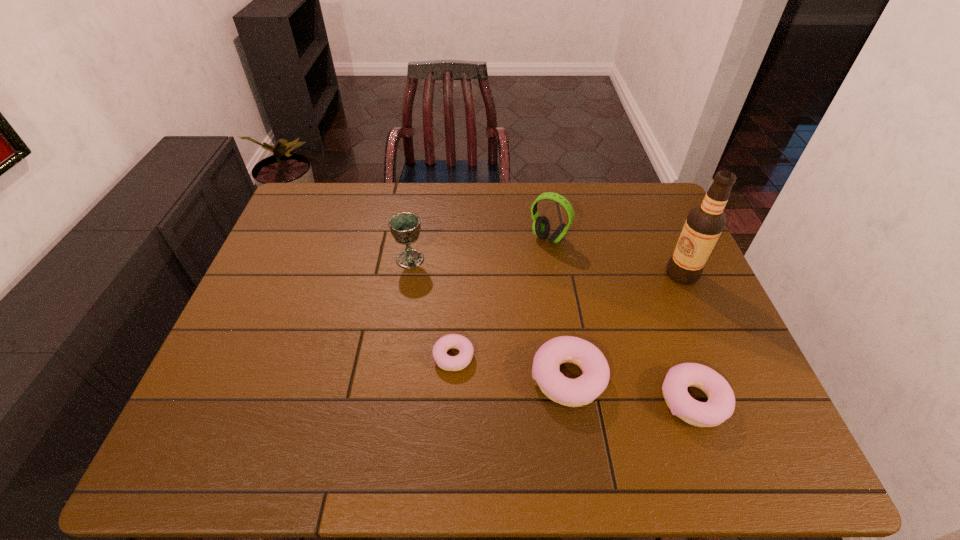
In order to click on vacant space at the near edge of the desktop in this screenshot , I will do `click(643, 389)`.

In the image, there is a desktop. At what (x,y) coordinates should I click in order to perform the action: click on vacant space at the left edge. Please return your answer as a coordinate pair (x, y). Image resolution: width=960 pixels, height=540 pixels. Looking at the image, I should click on coord(278,242).

This screenshot has height=540, width=960. In order to click on vacant space at the right edge of the desktop in this screenshot , I will do `click(682, 333)`.

Locate an element on the screen. This screenshot has width=960, height=540. vacant space at the far left corner of the desktop is located at coordinates 300,221.

Image resolution: width=960 pixels, height=540 pixels. Identify the location of vacant space at the far right corner. (636, 195).

The width and height of the screenshot is (960, 540). Find the location of `vacant space that is in between the chalice and the shortest doughnut`. vacant space that is in between the chalice and the shortest doughnut is located at coordinates (432, 308).

Locate an element on the screen. This screenshot has width=960, height=540. unoccupied position between the second doughnut from left to right and the headset is located at coordinates (559, 308).

Where is `unoccupied area between the second doughnut from right to left and the second tallest doughnut`? This screenshot has height=540, width=960. unoccupied area between the second doughnut from right to left and the second tallest doughnut is located at coordinates (631, 389).

You are a GUI agent. You are given a task and a screenshot of the screen. Output one action in this format:
    pyautogui.click(x=<x>, y=<y>)
    Task: Click on the vacant area that lies between the second tallest doughnut and the alcohol
    This screenshot has width=960, height=540.
    Given the screenshot: What is the action you would take?
    pyautogui.click(x=687, y=338)

This screenshot has width=960, height=540. I want to click on blank region between the headset and the shortest doughnut, so click(x=501, y=298).